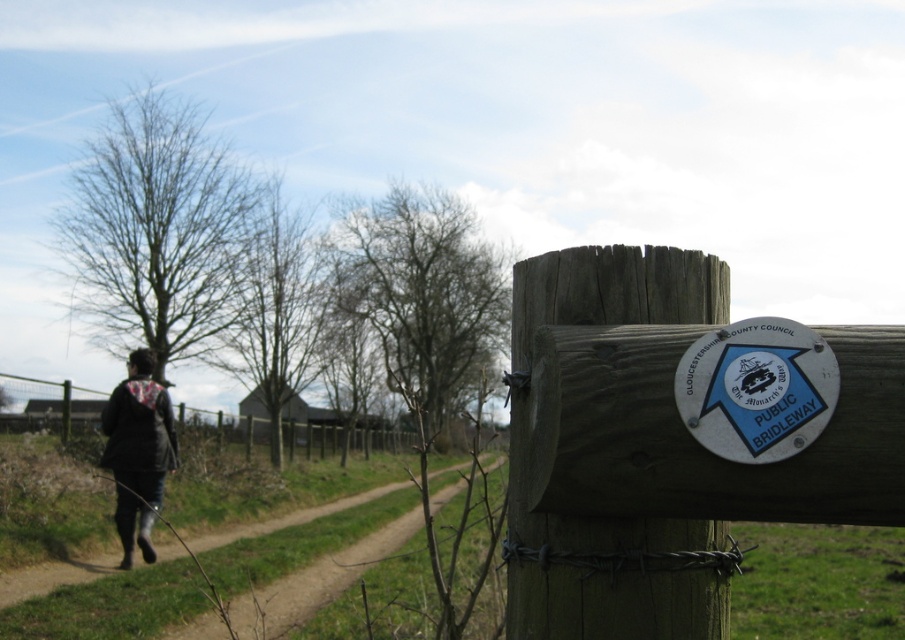
In the scene shown: Is green wood signpost at center to the right of black leather jacket at lower left from the viewer's perspective?

Indeed, green wood signpost at center is positioned on the right side of black leather jacket at lower left.

Does green wood signpost at center appear over black leather jacket at lower left?

Yes.

Between point (724, 573) and point (160, 433), which one is positioned in front?

Point (724, 573) is in front.

Find the location of a particular element. Image resolution: width=905 pixels, height=640 pixels. green wood signpost at center is located at coordinates pyautogui.click(x=556, y=451).

The image size is (905, 640). In order to click on brown dirt path at lower left in this screenshot , I will do `click(111, 605)`.

Does brown dirt path at lower left appear on the left side of black leather jacket at lower left?

In fact, brown dirt path at lower left is to the right of black leather jacket at lower left.

Does point (160, 572) come closer to viewer compared to point (140, 387)?

Yes.

At what (x,y) coordinates should I click in order to perform the action: click on brown dirt path at lower left. Please return your answer as a coordinate pair (x, y). The height and width of the screenshot is (640, 905). Looking at the image, I should click on (111, 605).

Does brown dirt path at lower left come in front of white metallic sign at upper center?

No, brown dirt path at lower left is behind white metallic sign at upper center.

Who is more distant from viewer, (187, 620) or (756, 364)?

The point (187, 620) is behind.

This screenshot has height=640, width=905. In order to click on brown dirt path at lower left in this screenshot , I will do `click(111, 605)`.